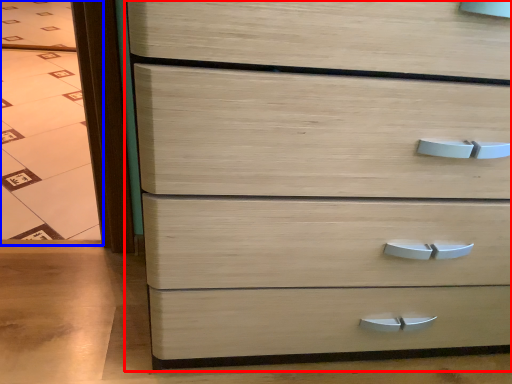
Question: Which object is further to the camera taking this photo, chest of drawers (highlighted by a red box) or glass door (highlighted by a blue box)?

Choices:
 (A) chest of drawers
 (B) glass door

Answer: (B)